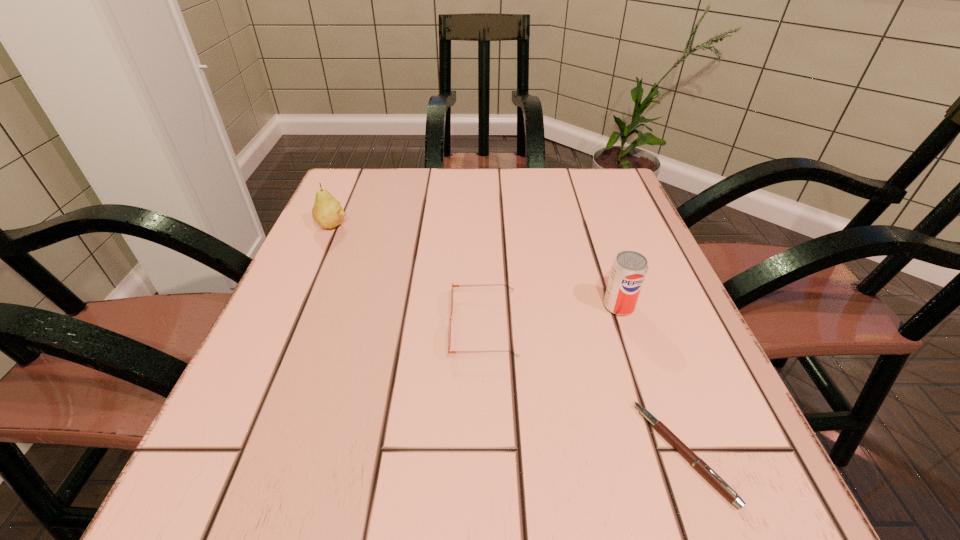
I want to click on free space between the nearest object and the pear, so click(x=508, y=339).

The width and height of the screenshot is (960, 540). Find the location of `empty space between the nearest object and the third object from right to left`. empty space between the nearest object and the third object from right to left is located at coordinates (584, 389).

I want to click on free space that is in between the nearest object and the sunglasses, so click(584, 389).

I want to click on free space that is in between the leftmost object and the third object from right to left, so click(408, 276).

The image size is (960, 540). Identify the location of free space between the pear and the soda. (475, 266).

You are a GUI agent. You are given a task and a screenshot of the screen. Output one action in this format:
    pyautogui.click(x=<x>, y=<y>)
    Task: Click on the vacant area that lies between the pear and the third tallest object
    The width and height of the screenshot is (960, 540).
    Given the screenshot: What is the action you would take?
    pyautogui.click(x=408, y=276)

This screenshot has width=960, height=540. Find the location of `free space between the third object from right to left and the soda`. free space between the third object from right to left and the soda is located at coordinates (551, 316).

In order to click on free space between the third tallest object and the farthest object in this screenshot , I will do pyautogui.click(x=408, y=276).

Where is `free point between the farthest object and the shortest object`? free point between the farthest object and the shortest object is located at coordinates (508, 339).

Select which object is the closest to the shortest object. Please provide its 2D coordinates. Your answer should be formatted as a tuple, i.e. [(x, y)], where the tuple contains the x and y coordinates of a point satisfying the conditions above.

[(629, 269)]